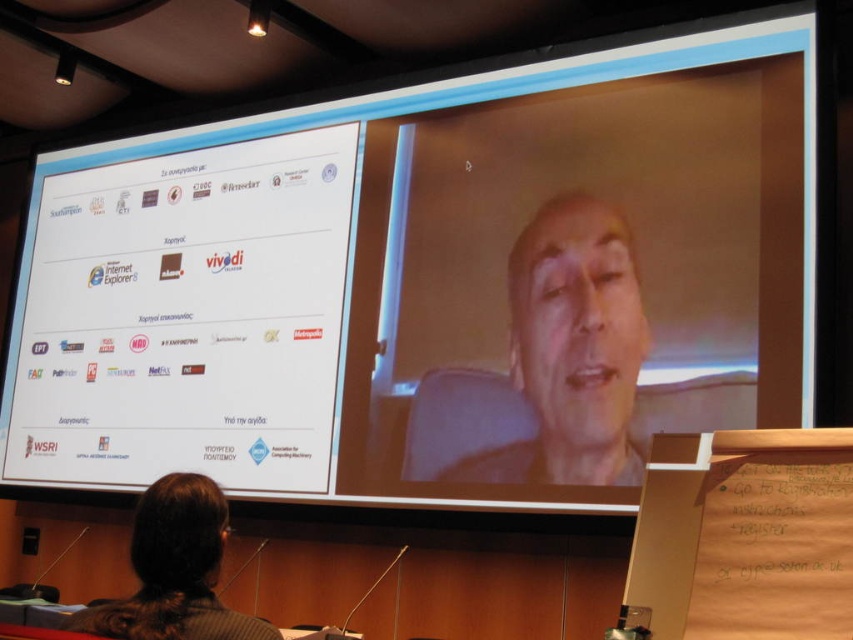
Does smooth skin face at center have a smaller size compared to brown hair at lower left?

Incorrect, smooth skin face at center is not smaller in size than brown hair at lower left.

Is point (553, 324) less distant than point (158, 634)?

That is False.

Locate an element on the screen. The height and width of the screenshot is (640, 853). smooth skin face at center is located at coordinates (572, 348).